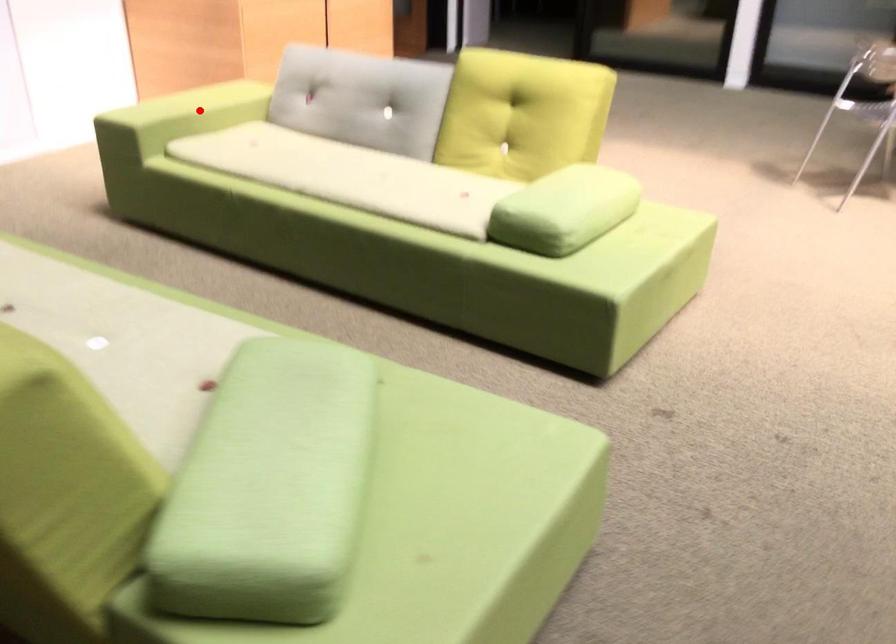
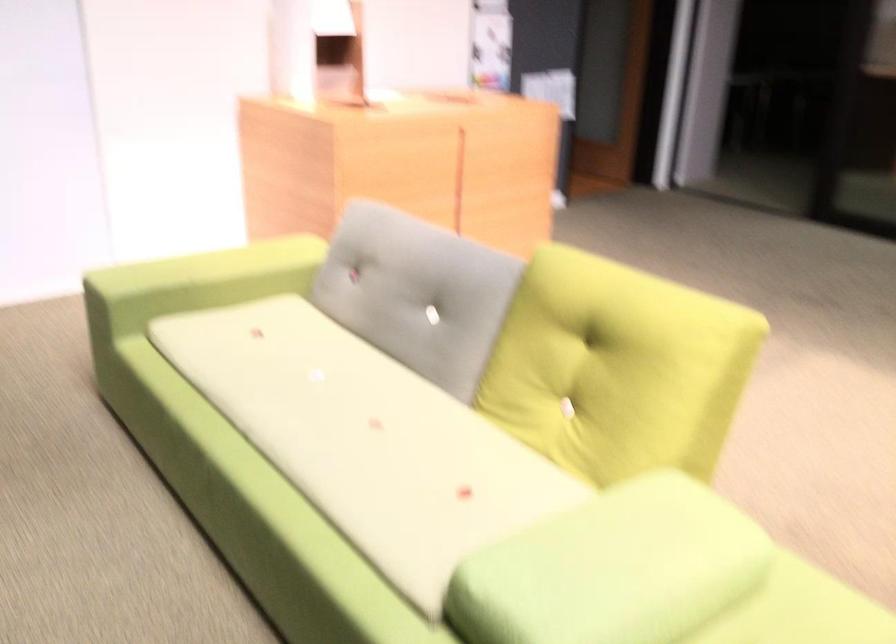
In the second image, find the point that corresponds to the highlighted location in the first image.

(194, 283)